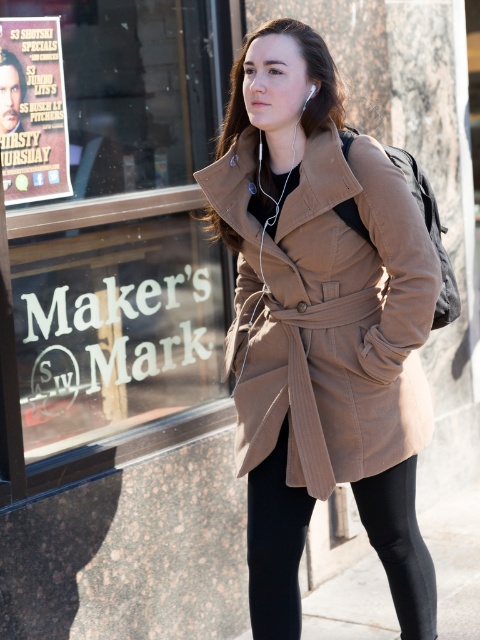
Question: Among these objects, which one is farthest from the camera?

Choices:
 (A) matte paper poster at upper left
 (B) black smooth leggings at lower center
 (C) corduroy brown coat at center

Answer: (A)

Question: Does corduroy brown coat at center lie behind black smooth leggings at lower center?

Choices:
 (A) no
 (B) yes

Answer: (A)

Question: Is black smooth leggings at lower center positioned in front of matte paper poster at upper left?

Choices:
 (A) yes
 (B) no

Answer: (A)

Question: Among these points, which one is farthest from the camera?

Choices:
 (A) (41, 161)
 (B) (385, 333)

Answer: (A)

Question: Is corduroy brown coat at center bigger than black smooth leggings at lower center?

Choices:
 (A) yes
 (B) no

Answer: (A)

Question: Among these points, which one is nearest to the camera?

Choices:
 (A) (27, 184)
 (B) (336, 332)

Answer: (B)